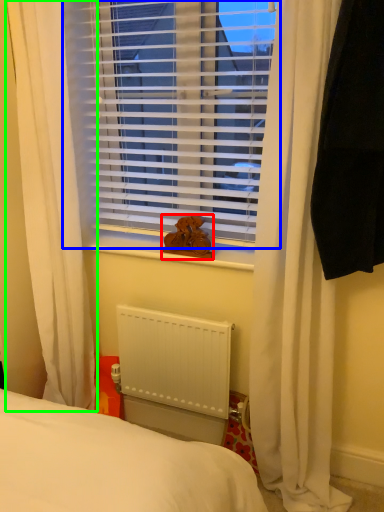
Question: Which object is positioned closest to animal (highlighted by a red box)? Select from window blind (highlighted by a blue box) and curtain (highlighted by a green box).

Choices:
 (A) window blind
 (B) curtain

Answer: (A)